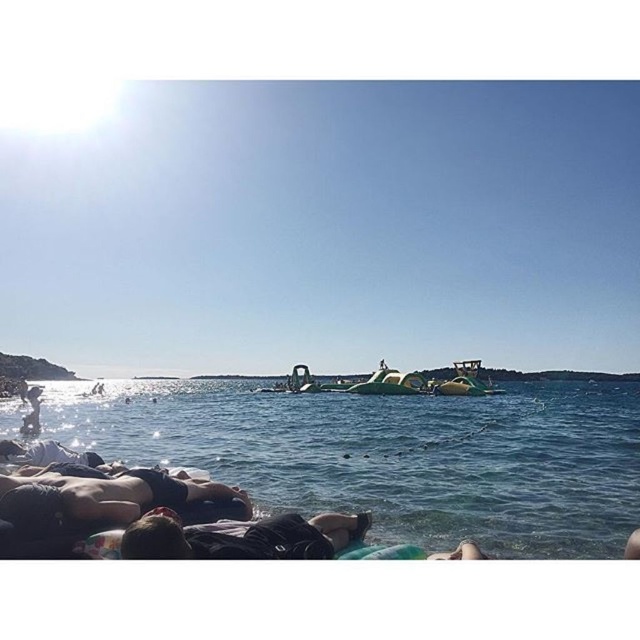
Question: Does clear blue water at lower left appear on the left side of dark skin human at lower left?

Choices:
 (A) no
 (B) yes

Answer: (A)

Question: Which of the following is the closest to the observer?

Choices:
 (A) smooth skin person at lower left
 (B) black fabric person at lower center
 (C) clear blue water at lower left

Answer: (B)

Question: Which object is positioned closest to the smooth skin person at lower left?

Choices:
 (A) black fabric person at lower center
 (B) clear blue water at lower left
 (C) dark skin human at lower left

Answer: (C)

Question: Does clear blue water at lower left have a greater width compared to dark skin human at lower left?

Choices:
 (A) no
 (B) yes

Answer: (B)

Question: Considering the real-world distances, which object is farthest from the black fabric person at lower center?

Choices:
 (A) smooth skin person at lower left
 (B) clear blue water at lower left
 (C) dark skin human at lower left

Answer: (B)

Question: Where is dark skin human at lower left located in relation to smooth skin person at lower left in the image?

Choices:
 (A) above
 (B) below

Answer: (A)